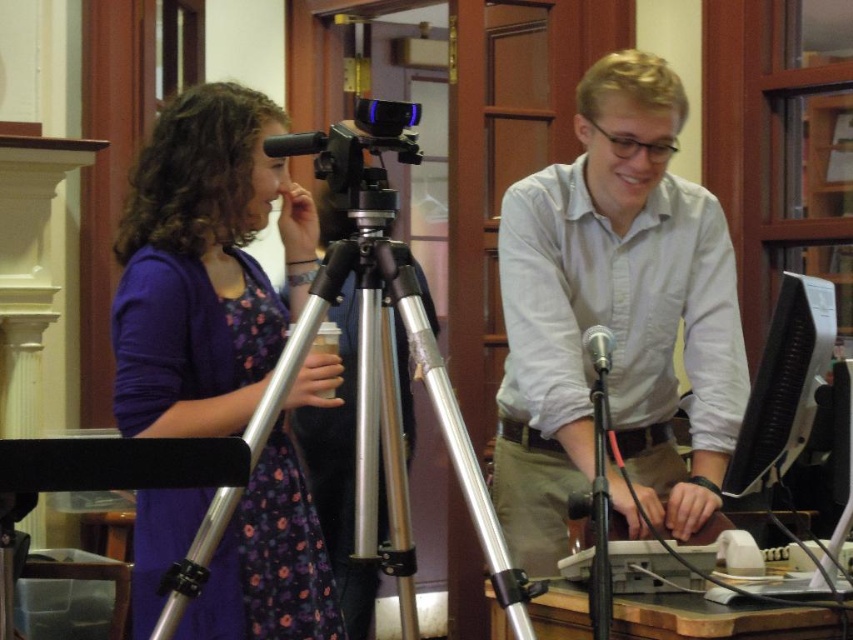
In the scene shown: Is black glossy monitor at right smaller than black plastic video camera at center?

No, black glossy monitor at right is not smaller than black plastic video camera at center.

Based on the photo, is black glossy monitor at right further to camera compared to black plastic video camera at center?

Yes, black glossy monitor at right is further from the viewer.

Where is `black glossy monitor at right`? black glossy monitor at right is located at coordinates (784, 385).

Is white cotton shirt at center positioned before purple fabric dress at left?

No, white cotton shirt at center is further to the viewer.

Which is below, white cotton shirt at center or purple fabric dress at left?

purple fabric dress at left is lower down.

Locate an element on the screen. This screenshot has height=640, width=853. white cotton shirt at center is located at coordinates (614, 316).

From the picture: Is silver metallic tripod at center further to the viewer compared to black glossy monitor at right?

No, it is in front of black glossy monitor at right.

Can you confirm if silver metallic tripod at center is positioned above black glossy monitor at right?

Actually, silver metallic tripod at center is below black glossy monitor at right.

Where is `silver metallic tripod at center`? This screenshot has height=640, width=853. silver metallic tripod at center is located at coordinates (392, 412).

Locate an element on the screen. The image size is (853, 640). silver metallic tripod at center is located at coordinates (392, 412).